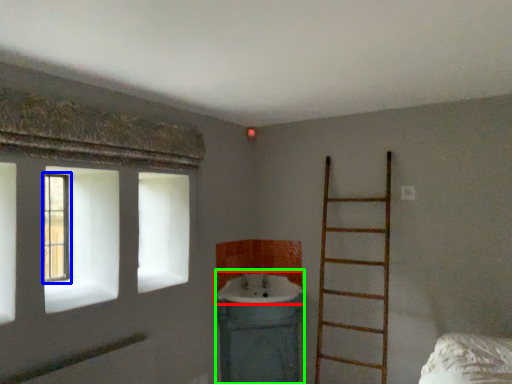
Question: Which object is the closest to the sink (highlighted by a red box)? Choose among these: window (highlighted by a blue box) or sink (highlighted by a green box).

Choices:
 (A) window
 (B) sink

Answer: (B)